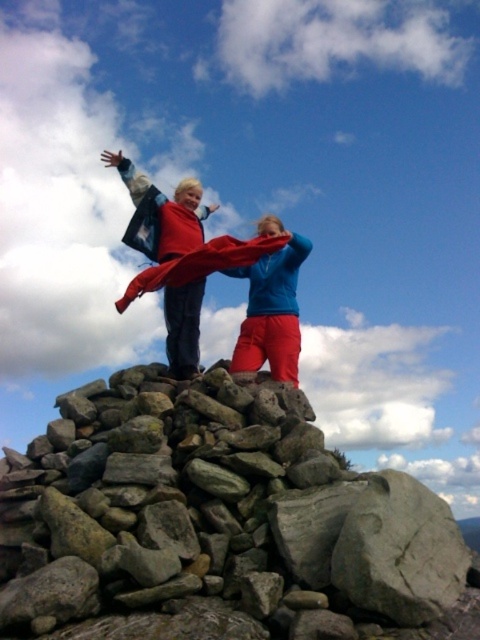
Between point (98, 410) and point (191, 182), which one is positioned behind?

The point (191, 182) is more distant.

Is gray rock pile at center shorter than matte red scarf at center?

Yes, gray rock pile at center is shorter than matte red scarf at center.

You are a GUI agent. You are given a task and a screenshot of the screen. Output one action in this format:
    pyautogui.click(x=<x>, y=<y>)
    Task: Click on the gray rock pile at center
    This screenshot has width=480, height=640.
    Given the screenshot: What is the action you would take?
    pyautogui.click(x=217, y=524)

Is point (6, 452) more distant than point (263, 353)?

No, it is in front of (263, 353).

Is gray rock pile at center positioned at the back of matte blue jacket at center?

No, gray rock pile at center is closer to the viewer.

Locate an element on the screen. This screenshot has width=480, height=640. gray rock pile at center is located at coordinates (217, 524).

Locate an element on the screen. gray rock pile at center is located at coordinates (217, 524).

Can you confirm if matte red scarf at center is positioned to the right of matte blue jacket at center?

No, matte red scarf at center is not to the right of matte blue jacket at center.

What do you see at coordinates (180, 257) in the screenshot? I see `matte red scarf at center` at bounding box center [180, 257].

Does point (230, 237) come closer to viewer compared to point (279, 262)?

Yes, point (230, 237) is in front of point (279, 262).

Image resolution: width=480 pixels, height=640 pixels. Identify the location of matte red scarf at center. (180, 257).